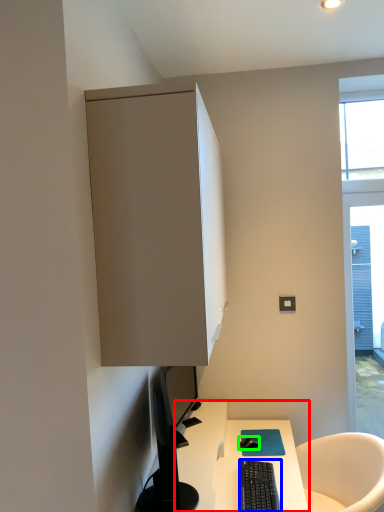
Question: Considering the real-world distances, which object is farthest from desk (highlighted by a red box)? computer keyboard (highlighted by a blue box) or mouse (highlighted by a green box)?

Choices:
 (A) computer keyboard
 (B) mouse

Answer: (B)